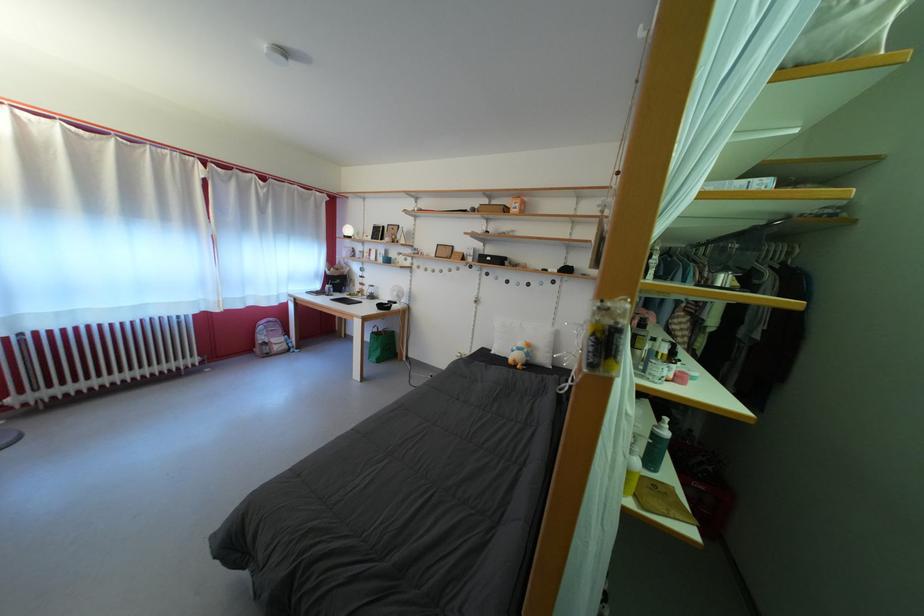
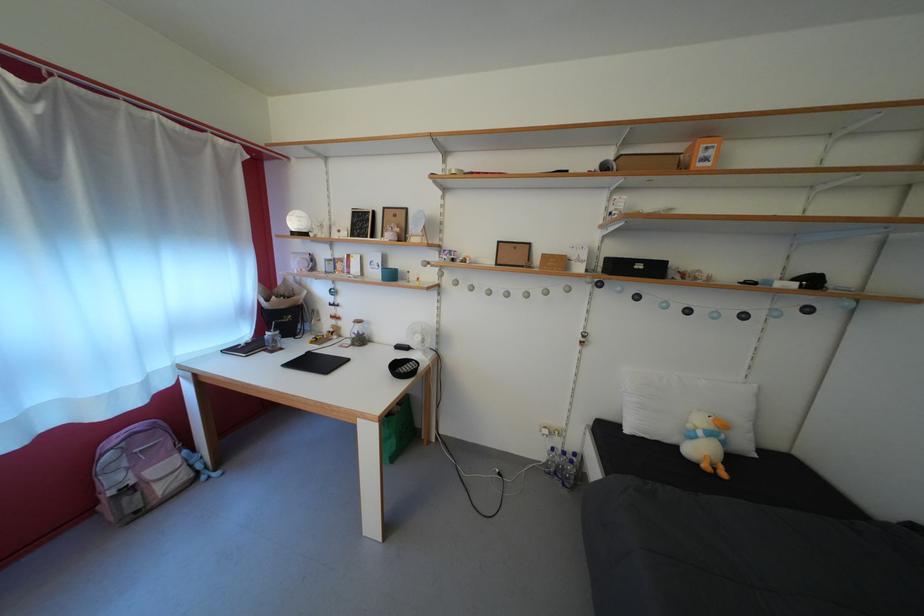
The point at (404, 300) is marked in the first image. Where is the corresponding point in the second image?

(427, 344)